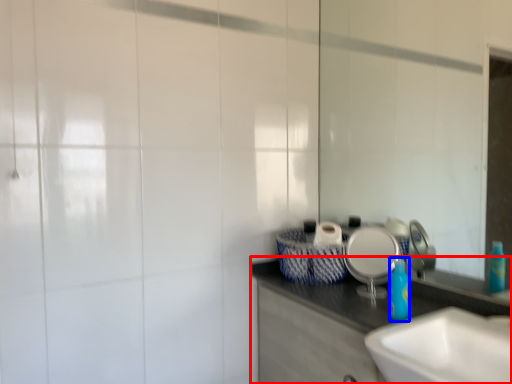
Question: Which object appears closest to the camera in this image, bathroom cabinet (highlighted by a red box) or bottle (highlighted by a blue box)?

Choices:
 (A) bathroom cabinet
 (B) bottle

Answer: (A)